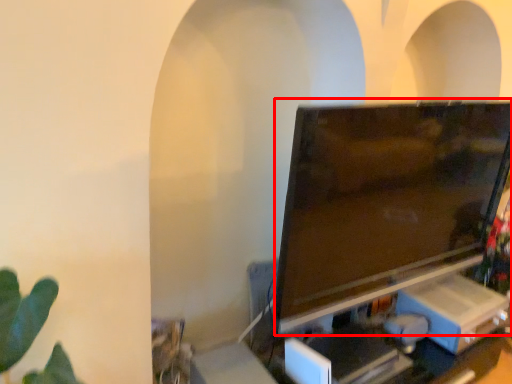
Question: Where is television (annotated by the red box) located in relation to computer desk in the image?

Choices:
 (A) left
 (B) right

Answer: (A)